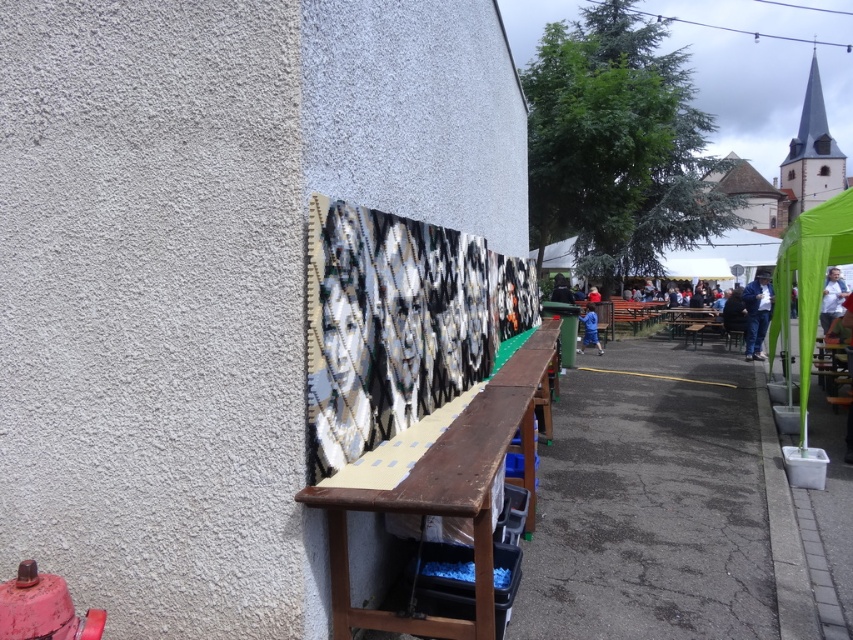
Question: Can you confirm if blue denim jacket at right is positioned to the left of blue fabric at center?

Choices:
 (A) yes
 (B) no

Answer: (B)

Question: Which of these objects is positioned closest to the black and white woven tapestry at center?

Choices:
 (A) green fabric canopy at right
 (B) white fabric at right
 (C) blue fabric at center
 (D) red painted hydrant at lower left

Answer: (D)

Question: Which of the following is the farthest from the observer?

Choices:
 (A) (843, 284)
 (B) (27, 614)
 (C) (590, 308)

Answer: (C)

Question: Is black and white woven tapestry at center behind green fabric canopy at right?

Choices:
 (A) no
 (B) yes

Answer: (A)

Question: Which point is farther to the camera?

Choices:
 (A) (834, 308)
 (B) (592, 333)

Answer: (B)

Question: Is black and white woven tapestry at center wider than blue fabric at center?

Choices:
 (A) yes
 (B) no

Answer: (A)